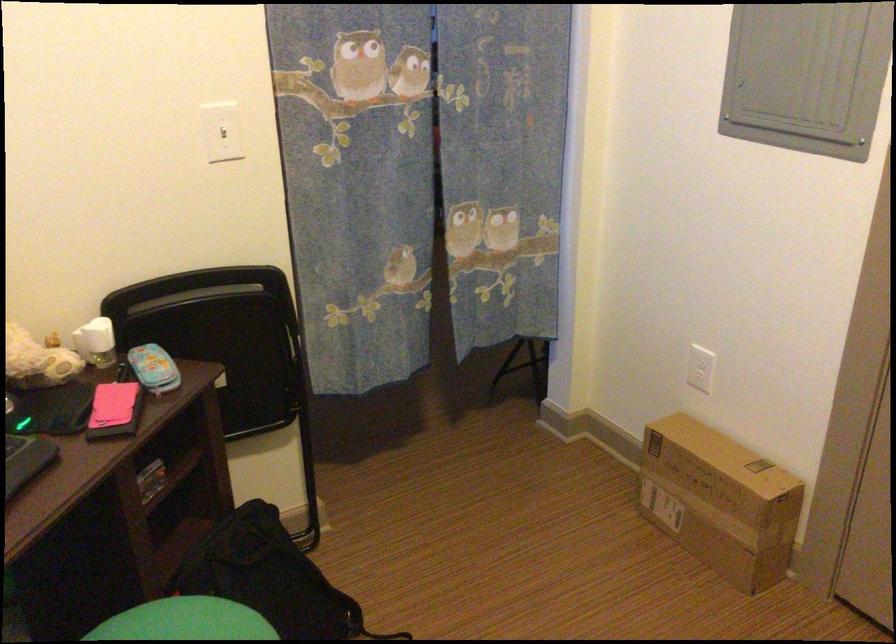
Image resolution: width=896 pixels, height=644 pixels. What do you see at coordinates (700, 368) in the screenshot?
I see `the white electrical outlet` at bounding box center [700, 368].